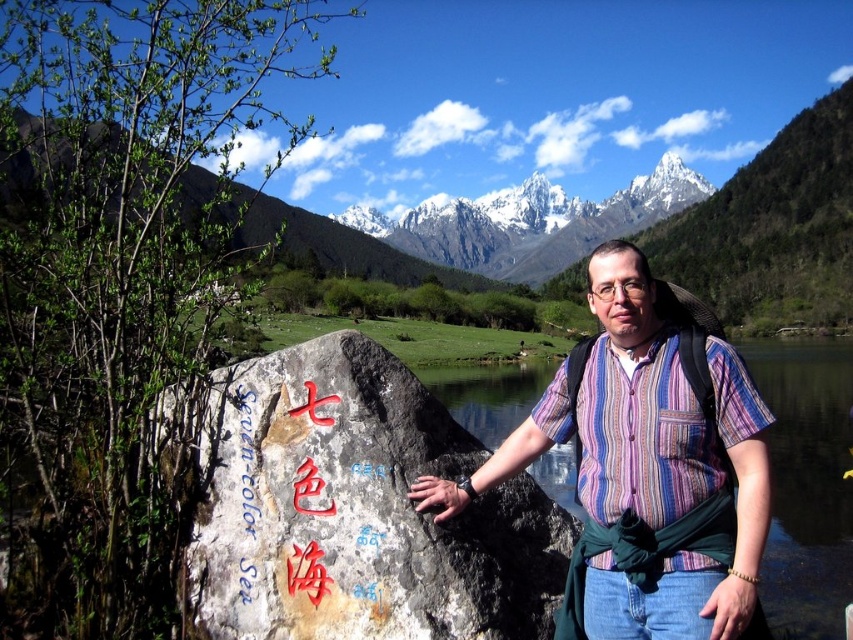
You are a photographer trying to capture a clear shot of the striped fabric shirt at center. However, the rusty stone boulder at center is blocking your view. Can you adjust your position to get an unobstructed view of the shirt?

The rusty stone boulder at center is closer to the viewer than the striped fabric shirt at center, so moving your camera position slightly to the side or adjusting the angle could allow you to see around the boulder and capture the striped fabric shirt at center without obstruction.

Based on the scene description, can you determine which object, the rusty stone boulder at center or the striped fabric shirt at center, has a greater width?

The rusty stone boulder at center is wider than the striped fabric shirt at center according to the description.